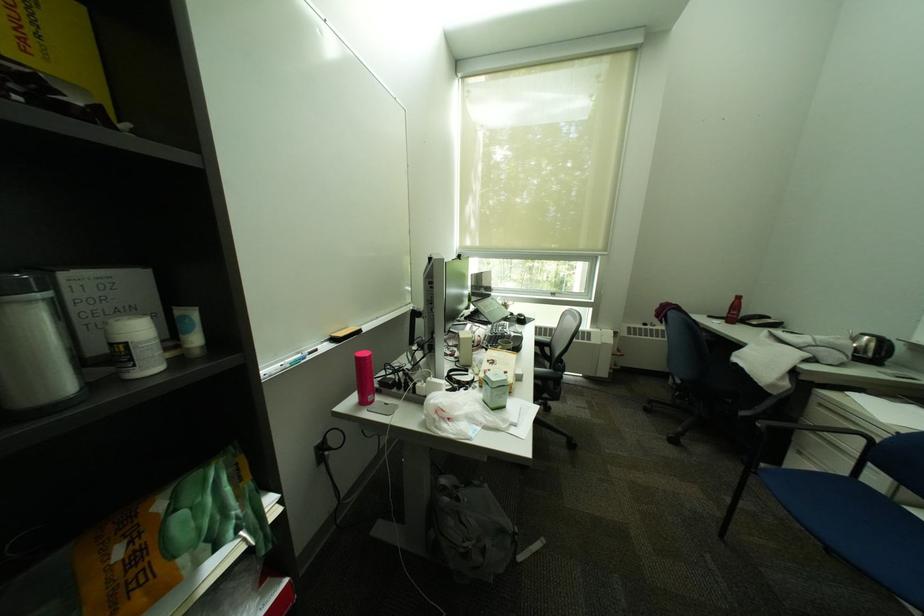
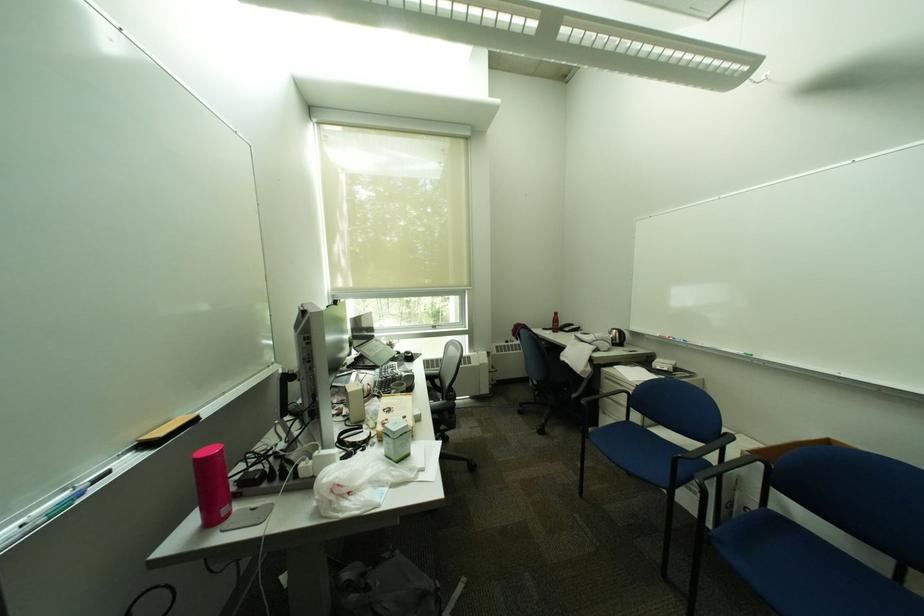
The point at (348, 432) is marked in the first image. Where is the corresponding point in the second image?

(168, 591)